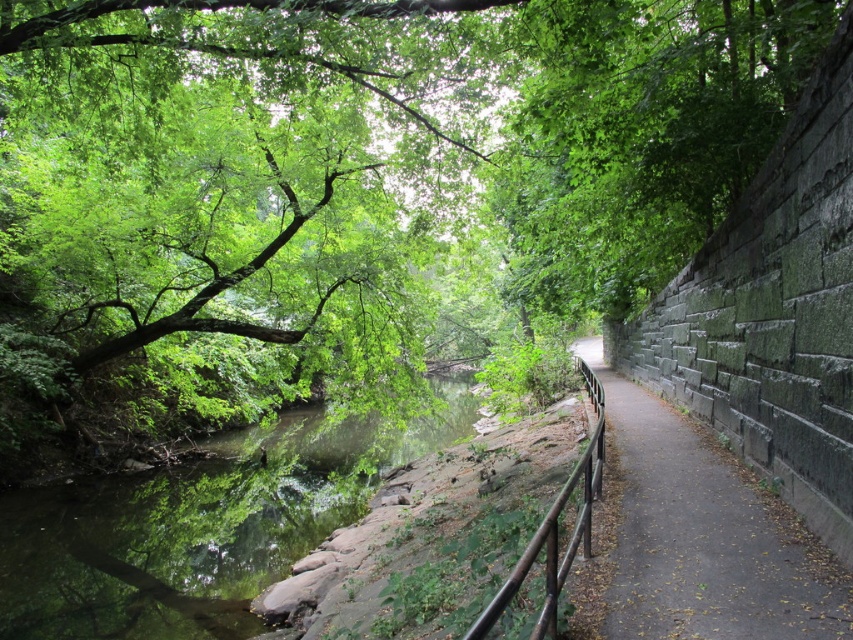
Between gray concrete path at right and brown wooden rail at center, which one has less height?

gray concrete path at right is shorter.

Does point (703, 486) lie behind point (514, 566)?

Yes.

Is point (624, 552) positioned after point (555, 618)?

Yes.

Locate an element on the screen. This screenshot has width=853, height=640. gray concrete path at right is located at coordinates (704, 536).

Which of these two, green reflective water at center or gray concrete path at right, stands shorter?

gray concrete path at right is shorter.

Is green reflective water at center wider than gray concrete path at right?

Indeed, green reflective water at center has a greater width compared to gray concrete path at right.

Is point (7, 582) closer to camera compared to point (730, 480)?

No, it is not.

The height and width of the screenshot is (640, 853). In order to click on green reflective water at center in this screenshot , I will do `click(200, 525)`.

Measure the distance between green reflective water at center and camera.

green reflective water at center is 9.59 meters away from camera.

Between point (241, 436) and point (585, 541), which one is positioned in front?

Positioned in front is point (585, 541).

Who is more distant from viewer, (310, 500) or (553, 596)?

The point (310, 500) is more distant.

Where is `green reflective water at center`? green reflective water at center is located at coordinates (200, 525).